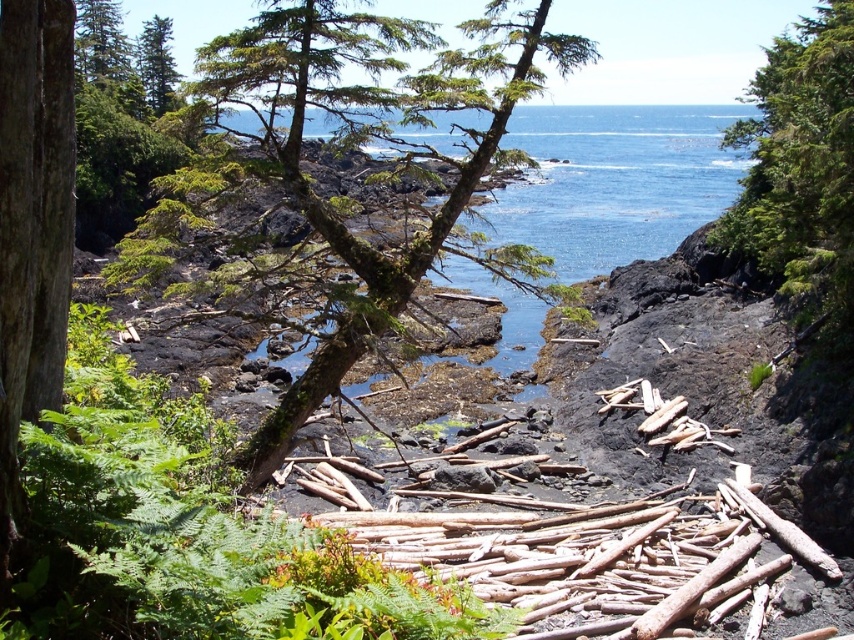
Is green mossy bark tree at center smaller than green mossy tree at upper center?

Incorrect, green mossy bark tree at center is not smaller in size than green mossy tree at upper center.

Which is more to the left, green mossy bark tree at center or green mossy tree at upper center?

Positioned to the left is green mossy bark tree at center.

Who is more forward, [316,365] or [793,250]?

Point [316,365] is more forward.

What are the coordinates of `green mossy bark tree at center` in the screenshot? It's located at (344, 195).

Who is shorter, green mossy bark tree at center or green rough bark tree at upper left?

green rough bark tree at upper left

Who is taller, green mossy bark tree at center or green rough bark tree at upper left?

Standing taller between the two is green mossy bark tree at center.

Which is behind, point (369, 16) or point (165, 104)?

Point (165, 104)

This screenshot has width=854, height=640. In order to click on green mossy bark tree at center in this screenshot , I will do `click(344, 195)`.

Is green mossy tree at upper center closer to camera compared to green rough bark tree at upper left?

Yes.

Between green mossy tree at upper center and green rough bark tree at upper left, which one is positioned higher?

green rough bark tree at upper left is higher up.

Where is `green mossy tree at upper center`? The image size is (854, 640). green mossy tree at upper center is located at coordinates pyautogui.click(x=800, y=168).